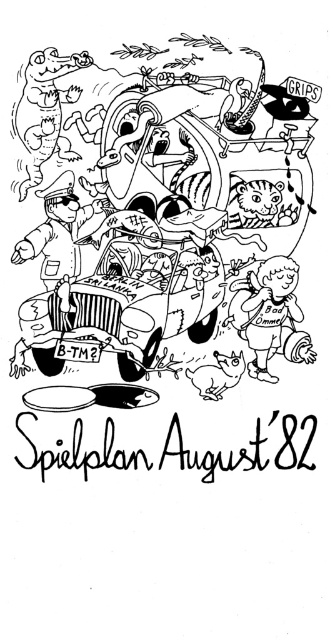
Question: Is black rubber car at center to the right of black matte car at center from the viewer's perspective?

Choices:
 (A) yes
 (B) no

Answer: (A)

Question: Is black rubber car at center positioned in front of black matte car at center?

Choices:
 (A) yes
 (B) no

Answer: (A)

Question: Which point is farther from the camera taking this photo?

Choices:
 (A) (195, 220)
 (B) (104, 308)

Answer: (A)

Question: Which object appears farthest from the camera in this image?

Choices:
 (A) black matte car at center
 (B) black rubber car at center

Answer: (A)

Question: Does black rubber car at center appear on the right side of black matte car at center?

Choices:
 (A) no
 (B) yes

Answer: (B)